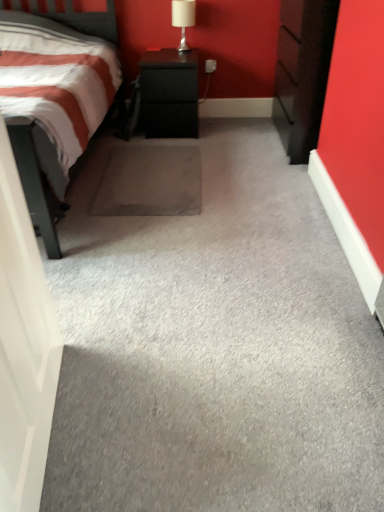
Find the location of a particular element. The width and height of the screenshot is (384, 512). free space in front of black textured cabinet at center is located at coordinates (167, 147).